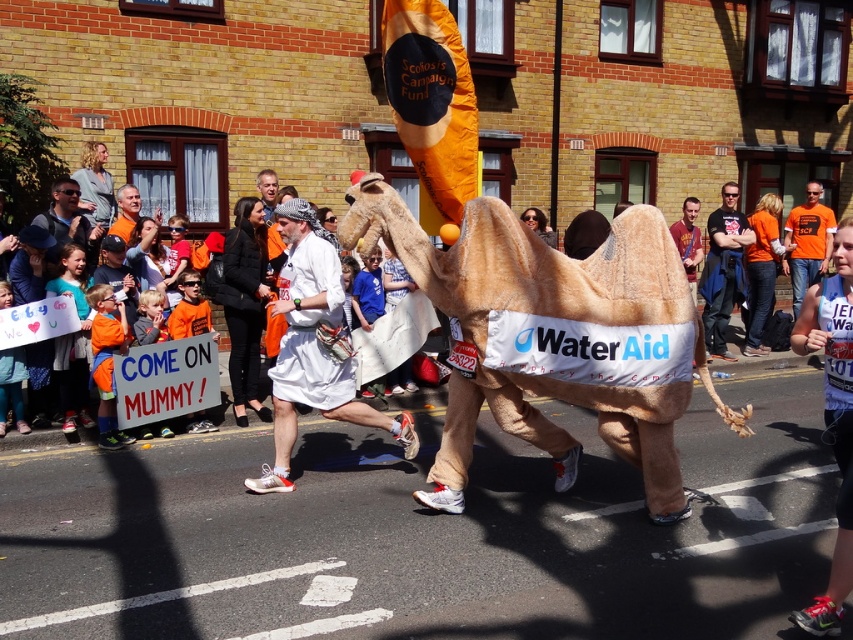
Does white fabric runner at center appear on the right side of orange cotton t-shirt at center?

Incorrect, white fabric runner at center is not on the right side of orange cotton t-shirt at center.

Can you confirm if white fabric runner at center is positioned below orange cotton t-shirt at center?

Yes, white fabric runner at center is below orange cotton t-shirt at center.

Is point (296, 388) closer to viewer compared to point (809, 230)?

Yes, it is.

Locate an element on the screen. white fabric runner at center is located at coordinates (314, 346).

Can you confirm if dark blue t-shirt at center is smaller than matte white shirt at center?

No.

Where is `dark blue t-shirt at center`? This screenshot has height=640, width=853. dark blue t-shirt at center is located at coordinates (723, 268).

Find the location of `dark blue t-shirt at center`. dark blue t-shirt at center is located at coordinates (723, 268).

Which is behind, point (83, 227) or point (129, 208)?

The point (129, 208) is behind.

Does matte white shirt at center appear over orange fabric man at center?

No, matte white shirt at center is not above orange fabric man at center.

Who is more distant from viewer, (78,237) or (123,184)?

Point (123,184)

Find the location of `matte white shirt at center`. matte white shirt at center is located at coordinates (68, 220).